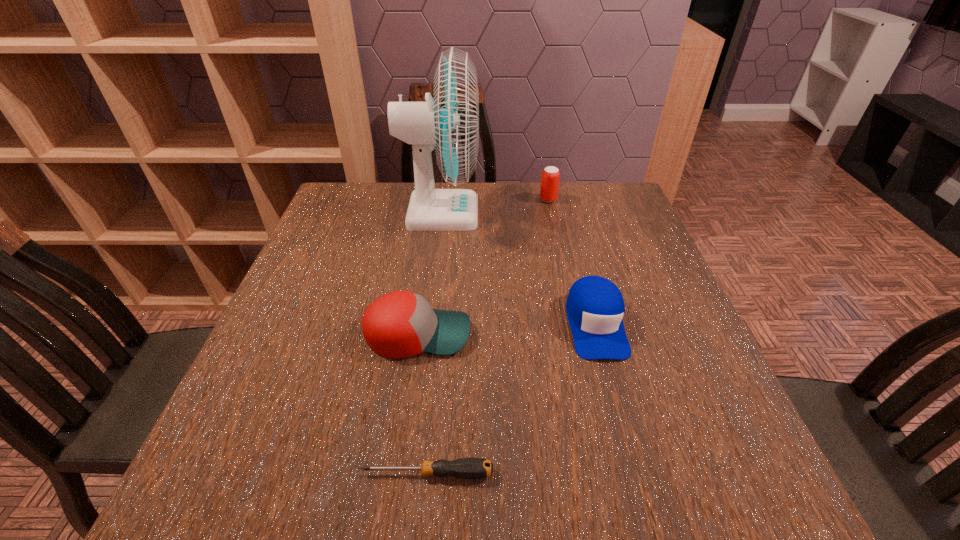
Identify the location of vacant area situated on the back of the screwdriver. The image size is (960, 540). (439, 348).

Find the location of `fan situated at the far edge`. fan situated at the far edge is located at coordinates (449, 123).

Find the location of `beer can that is at the far edge`. beer can that is at the far edge is located at coordinates (550, 176).

Where is `object at the near edge`? This screenshot has height=540, width=960. object at the near edge is located at coordinates (464, 468).

Where is `object at the right edge`? The width and height of the screenshot is (960, 540). object at the right edge is located at coordinates (595, 307).

The image size is (960, 540). I want to click on vacant space at the far edge, so click(501, 214).

The height and width of the screenshot is (540, 960). I want to click on vacant space at the near edge, so click(x=348, y=514).

Where is `vacant region at the left edge of the desktop`? vacant region at the left edge of the desktop is located at coordinates [317, 339].

Image resolution: width=960 pixels, height=540 pixels. In the image, there is a desktop. In order to click on vacant space at the right edge in this screenshot , I will do `click(687, 380)`.

In the image, there is a desktop. Find the location of `vacant space at the far left corner`. vacant space at the far left corner is located at coordinates (360, 190).